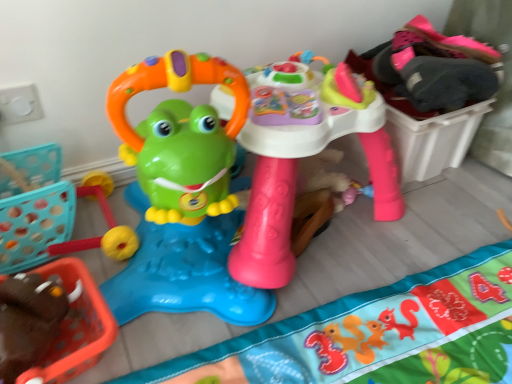
Question: Can matte plastic frog walker at center, the 1th toy in the left-to-right sequence, be found inside soft fabric play mat at center?

Choices:
 (A) no
 (B) yes

Answer: (A)

Question: Is soft fabric play mat at center smaller than matte plastic frog walker at center, the second toy from the right?

Choices:
 (A) no
 (B) yes

Answer: (B)

Question: Is soft fabric play mat at center not within matte plastic frog walker at center, the second toy from the right?

Choices:
 (A) yes
 (B) no

Answer: (A)

Question: Is soft fabric play mat at center directly adjacent to matte plastic frog walker at center, the second toy from the right?

Choices:
 (A) yes
 (B) no

Answer: (B)

Question: Is soft fabric play mat at center not close to matte plastic frog walker at center, the second toy from the right?

Choices:
 (A) no
 (B) yes

Answer: (A)

Question: Is matte plastic activity table at center, which is the second toy from left to right, inside the boundaries of matte plastic frog walker at center, the 1th toy in the left-to-right sequence, or outside?

Choices:
 (A) inside
 (B) outside

Answer: (B)

Question: From the image's perspective, relative to matte plastic frog walker at center, the second toy from the right, is matte plastic activity table at center, placed as the 1th toy when sorted from right to left, above or below?

Choices:
 (A) above
 (B) below

Answer: (A)

Question: Considering the positions of matte plastic activity table at center, placed as the 1th toy when sorted from right to left, and matte plastic frog walker at center, the 1th toy in the left-to-right sequence, in the image, is matte plastic activity table at center, placed as the 1th toy when sorted from right to left, taller or shorter than matte plastic frog walker at center, the 1th toy in the left-to-right sequence,?

Choices:
 (A) short
 (B) tall

Answer: (A)

Question: Would you say matte plastic activity table at center, placed as the 1th toy when sorted from right to left, is to the left or to the right of matte plastic frog walker at center, the 1th toy in the left-to-right sequence, in the picture?

Choices:
 (A) left
 (B) right

Answer: (B)

Question: Looking at their shapes, would you say soft fabric play mat at center is wider or thinner than matte plastic frog walker at center, the 1th toy in the left-to-right sequence?

Choices:
 (A) wide
 (B) thin

Answer: (A)

Question: In terms of size, does soft fabric play mat at center appear bigger or smaller than matte plastic frog walker at center, the second toy from the right?

Choices:
 (A) big
 (B) small

Answer: (B)

Question: From a real-world perspective, is soft fabric play mat at center above or below matte plastic frog walker at center, the second toy from the right?

Choices:
 (A) above
 (B) below

Answer: (B)

Question: Is soft fabric play mat at center situated inside matte plastic frog walker at center, the 1th toy in the left-to-right sequence, or outside?

Choices:
 (A) inside
 (B) outside

Answer: (B)

Question: In the image, is matte plastic frog walker at center, the second toy from the right, on the left side or the right side of matte plastic activity table at center, placed as the 1th toy when sorted from right to left?

Choices:
 (A) right
 (B) left

Answer: (B)

Question: Is point (216, 314) positioned closer to the camera than point (269, 190)?

Choices:
 (A) closer
 (B) farther

Answer: (B)